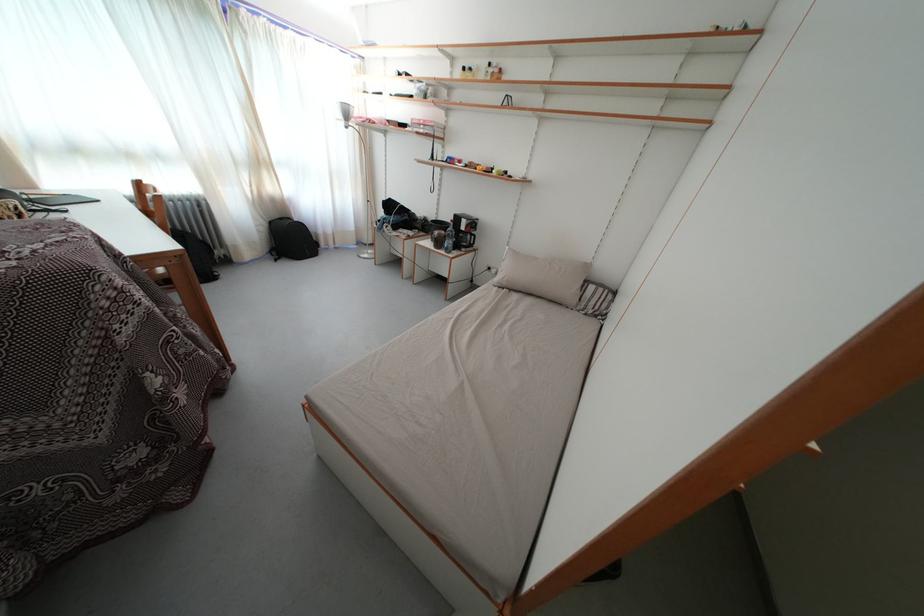
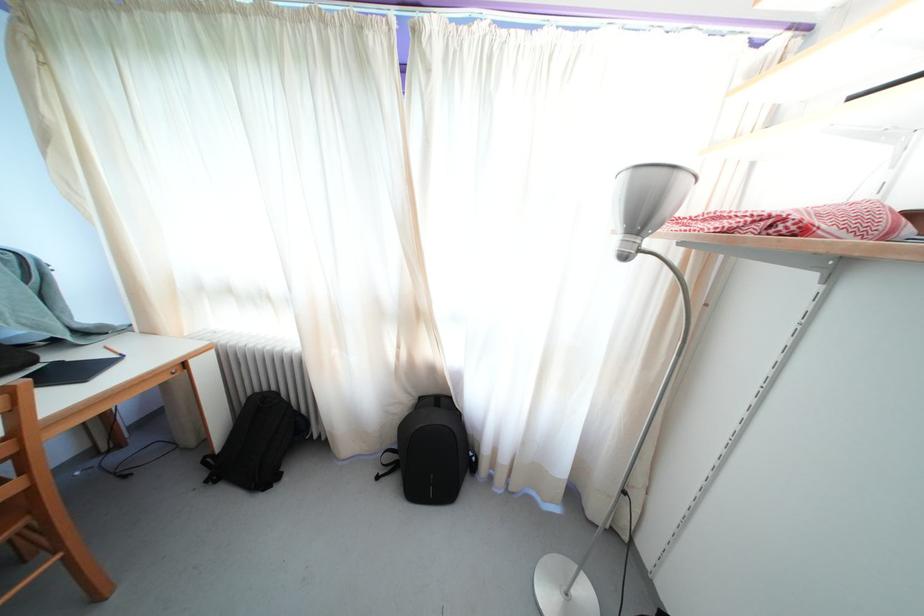
The point at (276,229) is marked in the first image. Where is the corresponding point in the second image?

(427, 405)